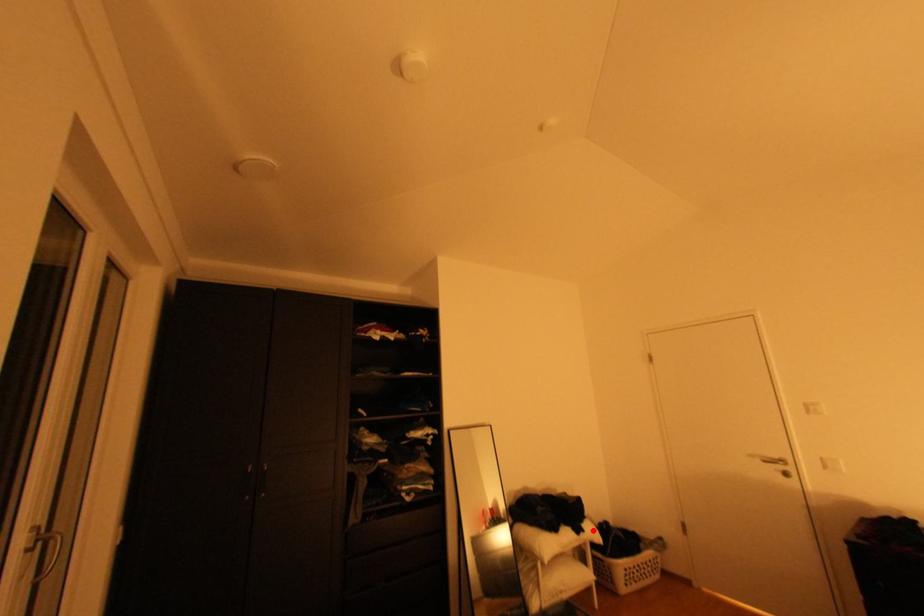
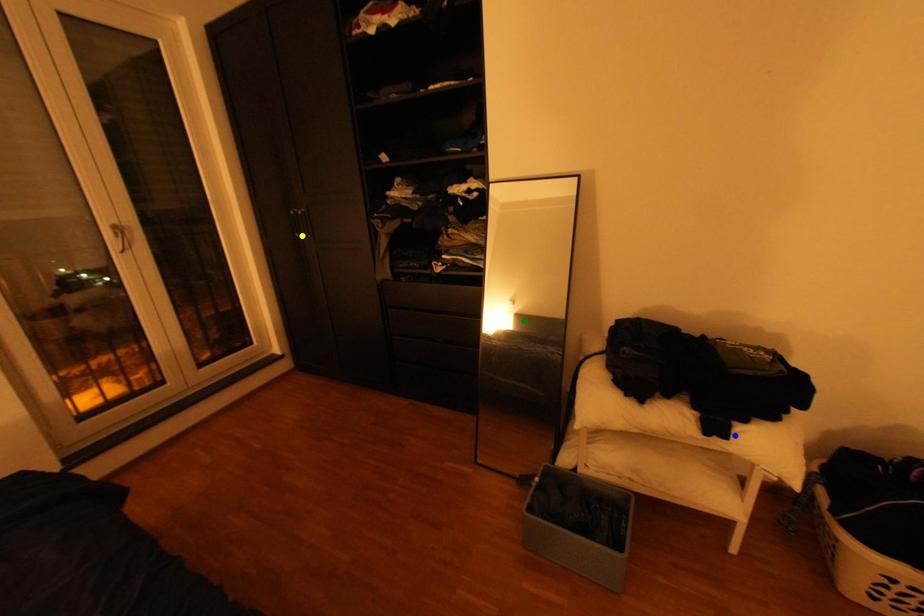
Question: I am providing you with two images of the same scene from different viewpoints. A red point is marked on the first image. You are given multiple points on the second image. Which point in image 2 is actually the same real-world point as the red point in image 1?

Choices:
 (A) yellow point
 (B) green point
 (C) blue point

Answer: (C)